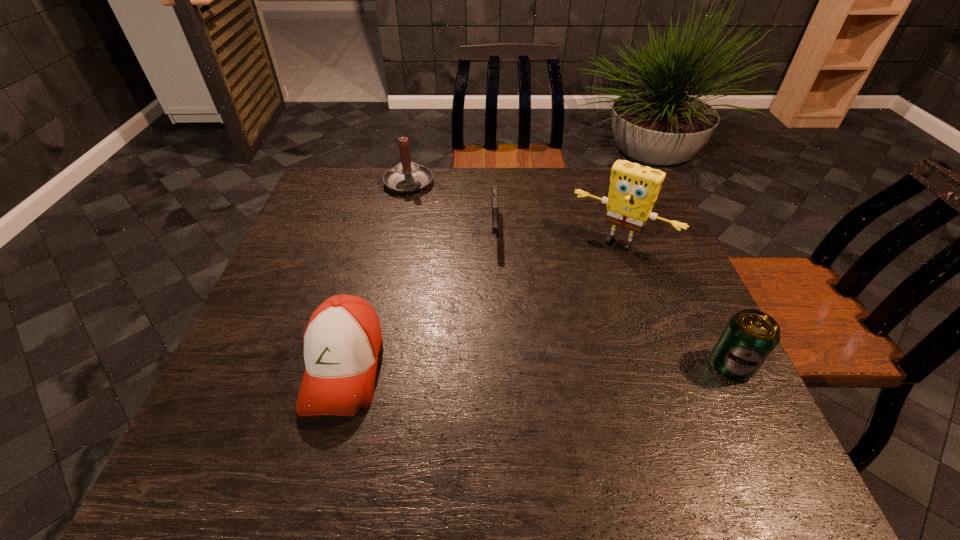
At what (x,y) coordinates should I click in order to perform the action: click on baseball cap. Please return your answer as a coordinate pair (x, y). Looking at the image, I should click on (342, 341).

Where is `beer can`? beer can is located at coordinates (750, 336).

Locate an element on the screen. Image resolution: width=960 pixels, height=540 pixels. the farthest object is located at coordinates (406, 177).

You are a GUI agent. You are given a task and a screenshot of the screen. Output one action in this format:
    pyautogui.click(x=<x>, y=<y>)
    Task: Click on the second tallest object
    
    Given the screenshot: What is the action you would take?
    pyautogui.click(x=406, y=177)

The width and height of the screenshot is (960, 540). Find the location of `gun`. gun is located at coordinates (494, 194).

You are a GUI agent. You are given a task and a screenshot of the screen. Output one action in this format:
    pyautogui.click(x=<x>, y=<y>)
    Task: Click on the third object from left to right
    The image size is (960, 540).
    Given the screenshot: What is the action you would take?
    pyautogui.click(x=494, y=194)

I want to click on the tallest object, so click(x=633, y=191).

This screenshot has height=540, width=960. Identify the location of free space located 0.370m on the back of the beer can. (669, 238).

This screenshot has height=540, width=960. I want to click on vacant space located 0.110m on the side of the second tallest object with the handle loop, so click(x=429, y=218).

Find the location of `free location located 0.080m on the side of the second tallest object with the handle loop`. free location located 0.080m on the side of the second tallest object with the handle loop is located at coordinates (426, 212).